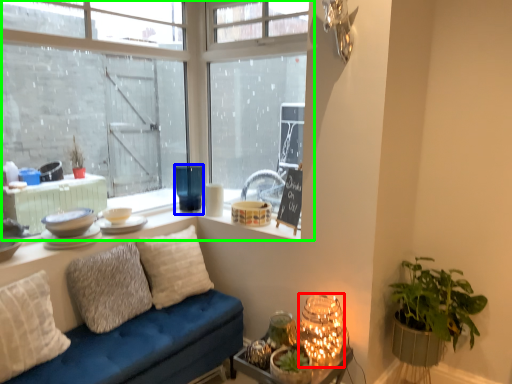
Question: Considering the real-world distances, which object is farthest from table (highlighted by a red box)? candle holder (highlighted by a blue box) or window (highlighted by a green box)?

Choices:
 (A) candle holder
 (B) window

Answer: (B)